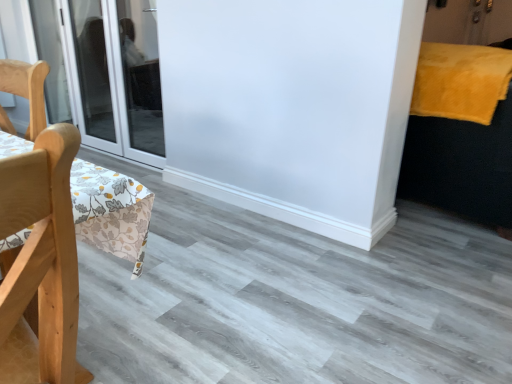
Question: From a real-world perspective, is velvet yellow bed at right physically above transparent glass door at left?

Choices:
 (A) yes
 (B) no

Answer: (B)

Question: Is velvet yellow bed at right positioned in front of transparent glass door at left?

Choices:
 (A) no
 (B) yes

Answer: (B)

Question: Considering the relative sizes of velvet yellow bed at right and transparent glass door at left in the image provided, is velvet yellow bed at right shorter than transparent glass door at left?

Choices:
 (A) no
 (B) yes

Answer: (B)

Question: Is velvet yellow bed at right looking in the opposite direction of transparent glass door at left?

Choices:
 (A) yes
 (B) no

Answer: (B)

Question: Is the position of velvet yellow bed at right more distant than that of transparent glass door at left?

Choices:
 (A) no
 (B) yes

Answer: (A)

Question: Is light wood chair at left spatially inside yellow fluffy blanket at upper right, or outside of it?

Choices:
 (A) outside
 (B) inside

Answer: (A)

Question: Is light wood chair at left taller or shorter than yellow fluffy blanket at upper right?

Choices:
 (A) short
 (B) tall

Answer: (B)

Question: From a real-world perspective, relative to yellow fluffy blanket at upper right, is light wood chair at left vertically above or below?

Choices:
 (A) below
 (B) above

Answer: (A)

Question: Does point (10, 213) appear closer or farther from the camera than point (496, 59)?

Choices:
 (A) closer
 (B) farther

Answer: (A)

Question: Considering the positions of point pyautogui.click(x=104, y=114) and point pyautogui.click(x=429, y=145), is point pyautogui.click(x=104, y=114) closer or farther from the camera than point pyautogui.click(x=429, y=145)?

Choices:
 (A) farther
 (B) closer

Answer: (A)

Question: Relative to velvet yellow bed at right, is transparent glass door at left in front or behind?

Choices:
 (A) behind
 (B) front

Answer: (A)

Question: Looking at their shapes, would you say transparent glass door at left is wider or thinner than velvet yellow bed at right?

Choices:
 (A) thin
 (B) wide

Answer: (A)

Question: From the image's perspective, is transparent glass door at left above or below velvet yellow bed at right?

Choices:
 (A) below
 (B) above

Answer: (B)

Question: Relative to yellow fluffy blanket at upper right, is transparent glass door at left in front or behind?

Choices:
 (A) behind
 (B) front

Answer: (A)

Question: Visually, is transparent glass door at left positioned to the left or to the right of yellow fluffy blanket at upper right?

Choices:
 (A) left
 (B) right

Answer: (A)